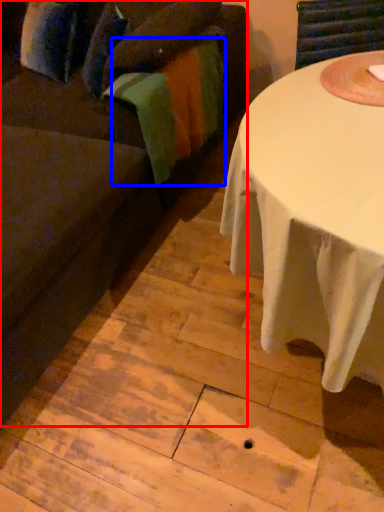
Question: Which of the following is the farthest to the observer, studio couch (highlighted by a red box) or blanket (highlighted by a blue box)?

Choices:
 (A) studio couch
 (B) blanket

Answer: (B)